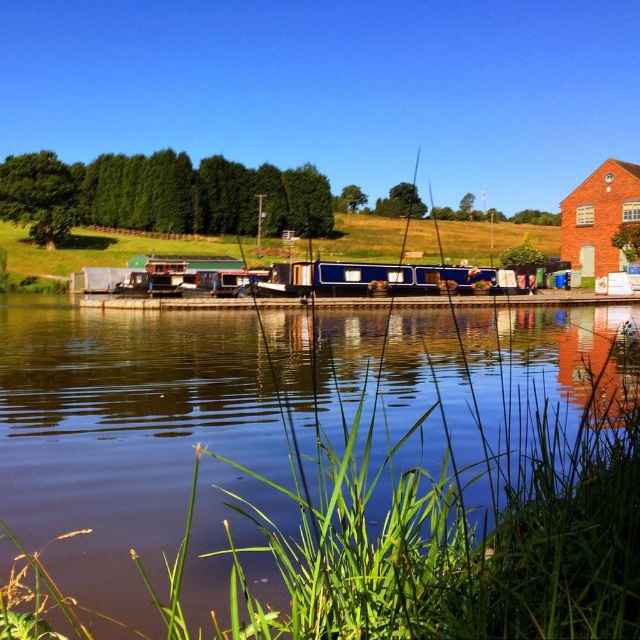
Which is below, blue glossy water at center or blue polished wood barge at center?

Positioned lower is blue glossy water at center.

Which of these two, blue glossy water at center or blue polished wood barge at center, stands shorter?

blue polished wood barge at center

What are the coordinates of `blue glossy water at center` in the screenshot? It's located at (272, 413).

You are a GUI agent. You are given a task and a screenshot of the screen. Output one action in this format:
    pyautogui.click(x=<x>, y=<y>)
    Task: Click on the blue glossy water at center
    
    Given the screenshot: What is the action you would take?
    pyautogui.click(x=272, y=413)